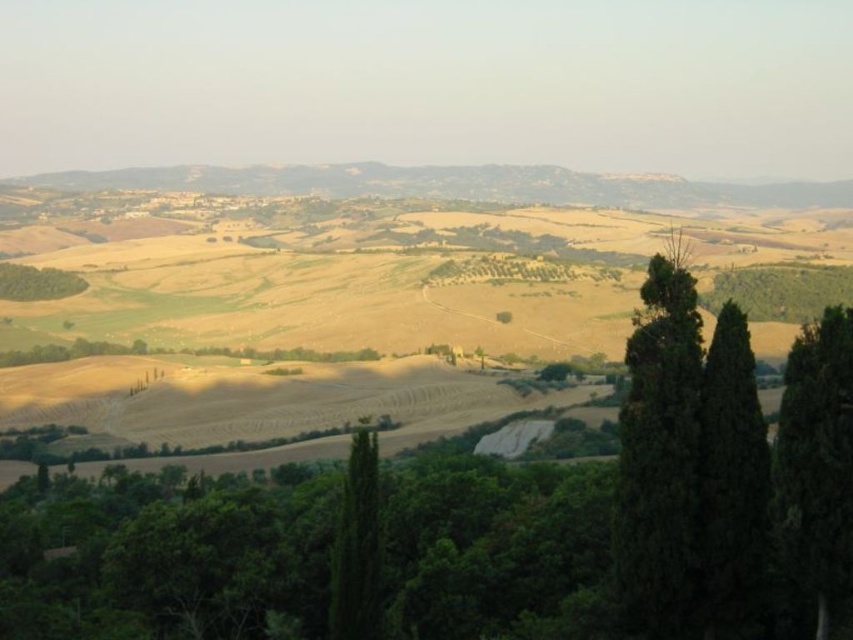
Can you confirm if green textured tree at center right is positioned below green leafy tree at lower left?

Yes.

Between green textured tree at center right and green leafy tree at lower left, which one is positioned higher?

green leafy tree at lower left is above.

Does point (846, 460) come farther from viewer compared to point (28, 285)?

No.

You are a GUI agent. You are given a task and a screenshot of the screen. Output one action in this format:
    pyautogui.click(x=<x>, y=<y>)
    Task: Click on the green textured tree at center right
    
    Given the screenshot: What is the action you would take?
    pyautogui.click(x=817, y=461)

Does green textured tree at center right appear on the left side of green textured tree at center?

Incorrect, green textured tree at center right is not on the left side of green textured tree at center.

Based on the photo, who is taller, green textured tree at center right or green textured tree at center?

Standing taller between the two is green textured tree at center right.

Is point (825, 337) positioned before point (363, 634)?

Yes.

You are a GUI agent. You are given a task and a screenshot of the screen. Output one action in this format:
    pyautogui.click(x=<x>, y=<y>)
    Task: Click on the green textured tree at center right
    Image resolution: width=853 pixels, height=640 pixels.
    Given the screenshot: What is the action you would take?
    pyautogui.click(x=817, y=461)

Locate an element on the screen. The image size is (853, 640). green textured tree at center is located at coordinates (357, 545).

From the picture: Can you confirm if green textured tree at center is positioned above green leafy tree at lower left?

Actually, green textured tree at center is below green leafy tree at lower left.

Is point (329, 636) in front of point (16, 300)?

That is True.

The image size is (853, 640). In order to click on green textured tree at center in this screenshot , I will do (357, 545).